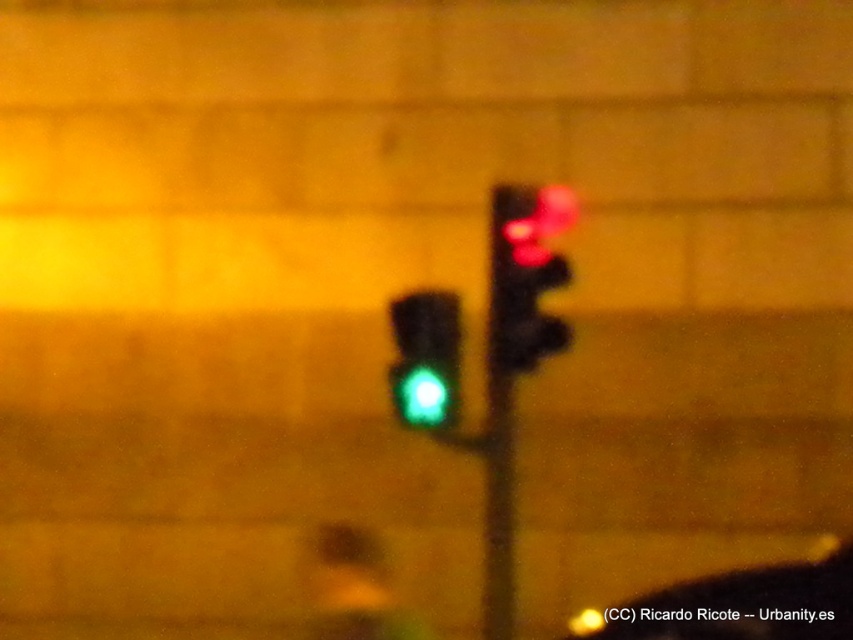
You are a pedestrian standing at the crosswalk and want to cross the street. You see the matte black traffic light at upper right and the green glass traffic light at center. Which traffic light should you pay attention to for crossing safely?

You should pay attention to the matte black traffic light at upper right because it is closer to you than the green glass traffic light at center, so it is more likely the one controlling the crosswalk you are at.

You are a driver approaching an intersection at night. You see the matte black traffic light at upper right. Based on its position, can you estimate whether it is positioned to your left or right side of the road?

The matte black traffic light at upper right is located at point (526, 273), which places it on the right side of the road from the driver perspective.